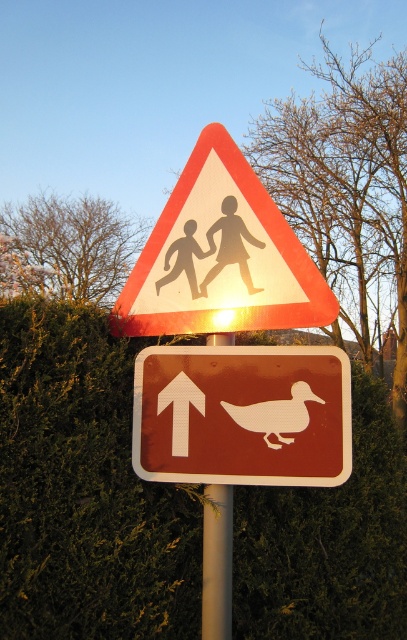
Who is lower down, green leafy hedge at center or metallic silver pole at center?

metallic silver pole at center

Does green leafy hedge at center have a lesser height compared to metallic silver pole at center?

No.

Which is behind, point (74, 522) or point (210, 522)?

Positioned behind is point (210, 522).

The height and width of the screenshot is (640, 407). Find the location of `green leafy hedge at center`. green leafy hedge at center is located at coordinates (85, 490).

The height and width of the screenshot is (640, 407). In order to click on green leafy hedge at center in this screenshot , I will do coord(85,490).

Which is in front, point (183, 564) or point (181, 458)?

Point (181, 458)

Identify the location of green leafy hedge at center. This screenshot has width=407, height=640. (85, 490).

Can you confirm if white glossy pedestrian crossing sign at upper center is taller than metallic silver pole at center?

Yes, white glossy pedestrian crossing sign at upper center is taller than metallic silver pole at center.

Does white glossy pedestrian crossing sign at upper center come in front of metallic silver pole at center?

Yes, it is in front of metallic silver pole at center.

Which is in front, point (166, 250) or point (205, 541)?

Positioned in front is point (205, 541).

In order to click on white glossy pedestrian crossing sign at upper center in this screenshot , I will do `click(221, 257)`.